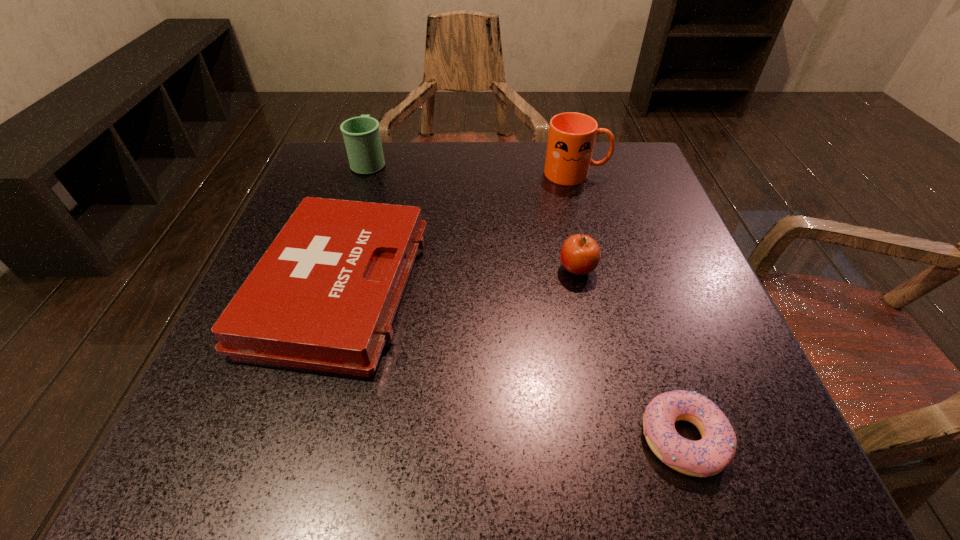
Where is `free space at the right edge`? Image resolution: width=960 pixels, height=540 pixels. free space at the right edge is located at coordinates (626, 230).

In the image, there is a desktop. Where is `vacant region at the far left corner`? vacant region at the far left corner is located at coordinates (348, 197).

What are the coordinates of `vacant space at the far right corner of the desktop` in the screenshot? It's located at 610,174.

You are a GUI agent. You are given a task and a screenshot of the screen. Output one action in this format:
    pyautogui.click(x=<x>, y=<y>)
    Task: Click on the free space between the shortest object and the tallest object
    
    Given the screenshot: What is the action you would take?
    pyautogui.click(x=629, y=306)

At what (x,y) coordinates should I click in order to perform the action: click on vacant space in between the apple and the taller mug. Please return your answer as a coordinate pair (x, y). The width and height of the screenshot is (960, 540). Looking at the image, I should click on (577, 221).

The width and height of the screenshot is (960, 540). In order to click on free space between the apple and the doughnut in this screenshot , I will do `click(630, 354)`.

Where is `vacant area that lies between the first-aid kit and the tallest object`? vacant area that lies between the first-aid kit and the tallest object is located at coordinates (457, 231).

Identify the location of vacant region between the shortest object and the apple. (630, 354).

You are a GUI agent. You are given a task and a screenshot of the screen. Output one action in this format:
    pyautogui.click(x=<x>, y=<y>)
    Task: Click on the vacant area that lies between the apple and the first-aid kit
    This screenshot has height=540, width=960.
    Given the screenshot: What is the action you would take?
    pyautogui.click(x=458, y=279)

Identify the location of blank region between the taller mug and the first-aid kit. (457, 231).